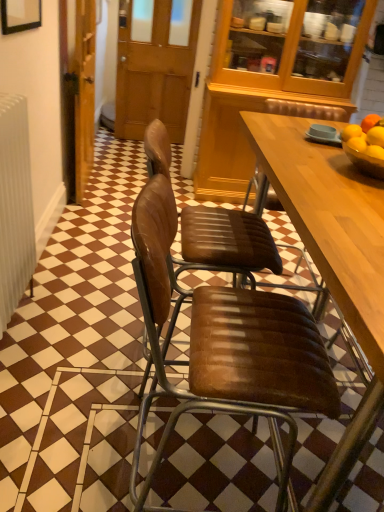
Find the location of a particular element. free space to the right of wooden door at left is located at coordinates (114, 187).